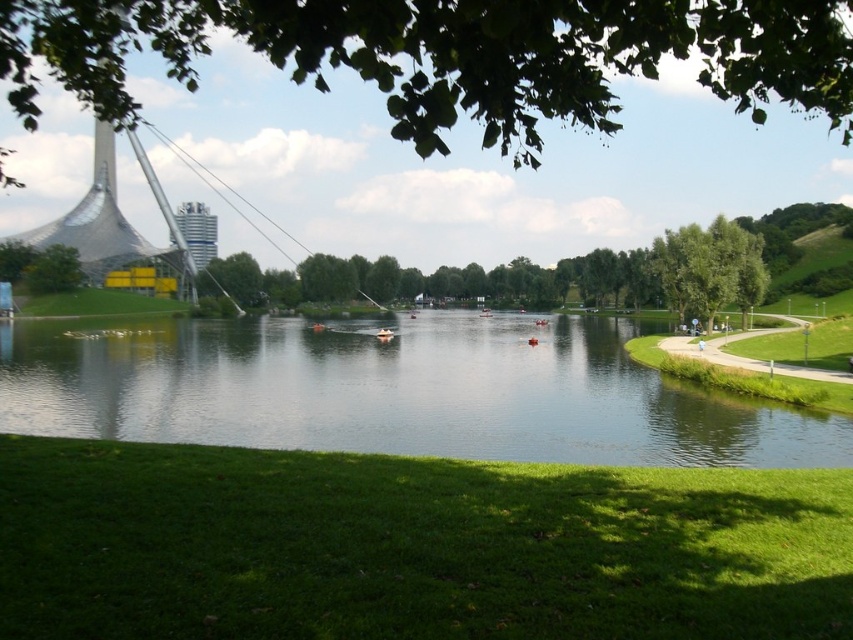
From the picture: You are standing in the park and want to walk from the grassy area to the water. There are two points marked on the path. Which point should you go to first, point [10,342] or point [50,288]?

You should go to point [10,342] first because it is in front of point [50,288], meaning it is closer to your current position on the grassy area.

You are standing in the park and see the green leafy tree at right and the green leafy tree at left. Which tree is positioned lower in the image?

The green leafy tree at right is located below the green leafy tree at left, so it is positioned lower in the image.

You are standing in the park and want to take a photo of the green leafy tree at upper center. If you look at the coordinates provided, where exactly would you point your camera to capture it?

The green leafy tree at upper center is located at coordinates point (451, 54). Point your camera there to capture it.